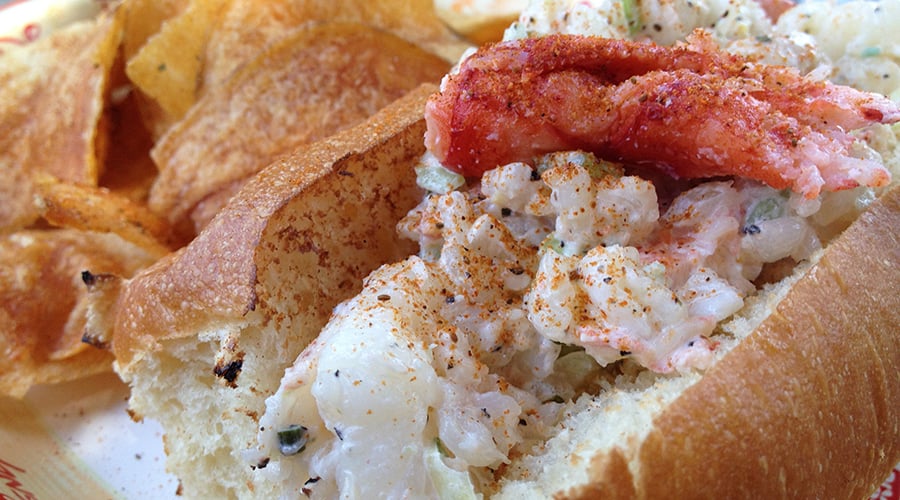
Image resolution: width=900 pixels, height=500 pixels. I want to click on countertop, so click(120, 455).